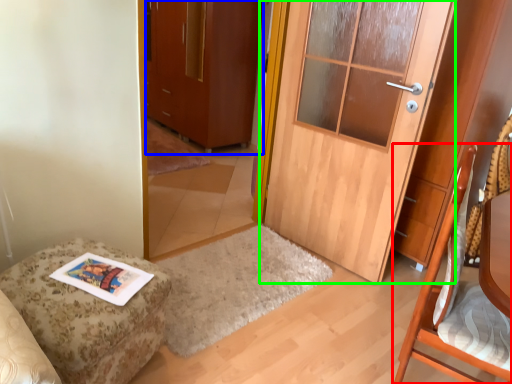
Question: Considering the real-world distances, which object is closest to chair (highlighted by a red box)? cabinetry (highlighted by a blue box) or door (highlighted by a green box).

Choices:
 (A) cabinetry
 (B) door

Answer: (B)